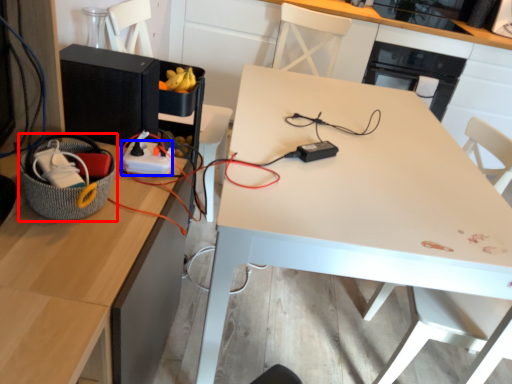
Question: Which of the following is the closest to the observer, basket (highlighted by a red box) or extension cord (highlighted by a blue box)?

Choices:
 (A) basket
 (B) extension cord

Answer: (A)